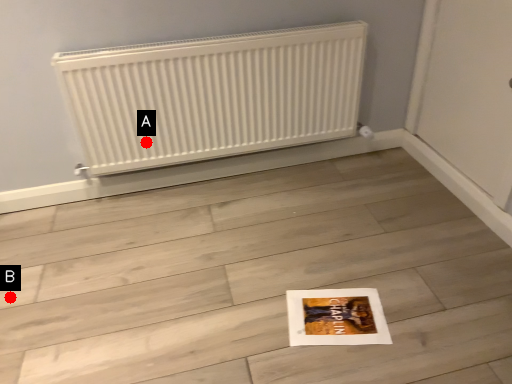
Question: Two points are circled on the image, labeled by A and B beside each circle. Among these points, which one is farthest from the camera?

Choices:
 (A) A is further
 (B) B is further

Answer: (A)